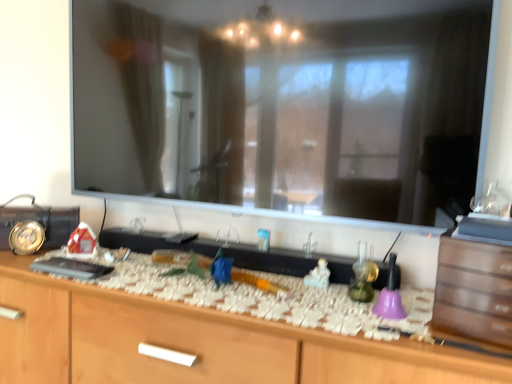
Question: Considering the positions of point (199, 322) and point (502, 324), is point (199, 322) closer or farther from the camera than point (502, 324)?

Choices:
 (A) closer
 (B) farther

Answer: (B)

Question: Visually, is wooden cabinet at center positioned to the left or to the right of brown wooden drawer at right?

Choices:
 (A) left
 (B) right

Answer: (A)

Question: Looking at their shapes, would you say wooden cabinet at center is wider or thinner than brown wooden drawer at right?

Choices:
 (A) thin
 (B) wide

Answer: (B)

Question: Is brown wooden drawer at right bigger or smaller than wooden cabinet at center?

Choices:
 (A) big
 (B) small

Answer: (B)

Question: Is brown wooden drawer at right to the left or to the right of wooden cabinet at center in the image?

Choices:
 (A) left
 (B) right

Answer: (B)

Question: Is point [465, 269] positioned closer to the camera than point [162, 362]?

Choices:
 (A) closer
 (B) farther

Answer: (A)

Question: In terms of width, does brown wooden drawer at right look wider or thinner when compared to wooden cabinet at center?

Choices:
 (A) wide
 (B) thin

Answer: (B)